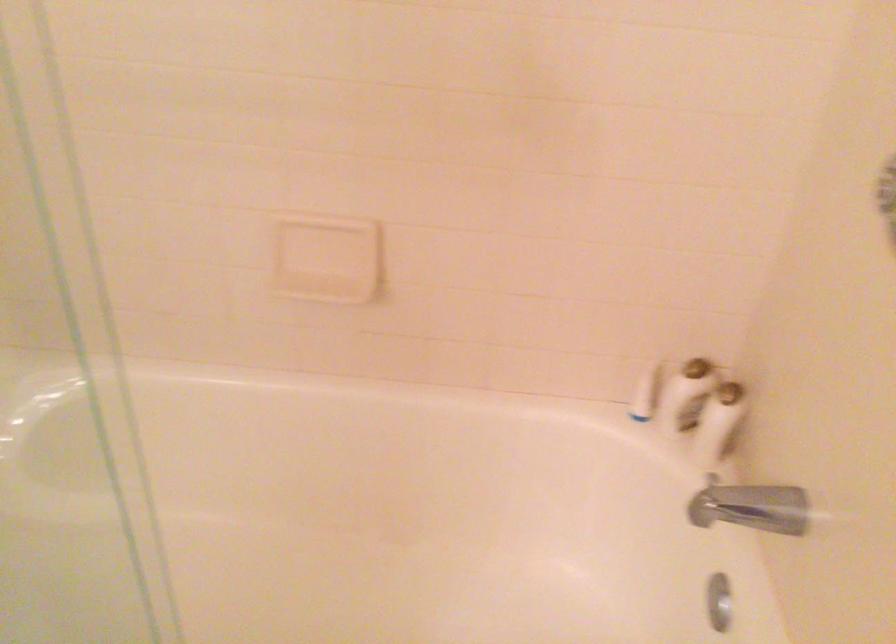
The height and width of the screenshot is (644, 896). What do you see at coordinates (757, 507) in the screenshot?
I see `the faucet handle` at bounding box center [757, 507].